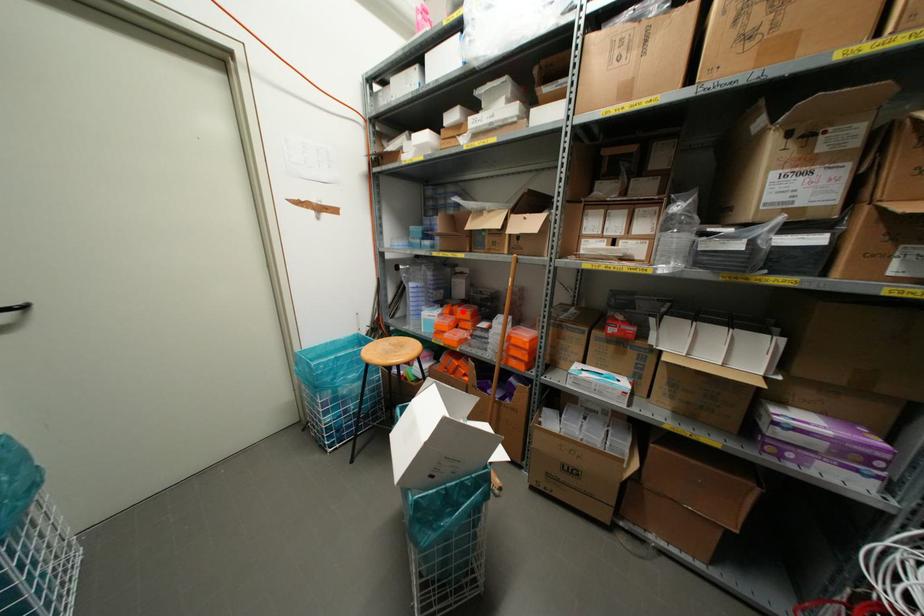
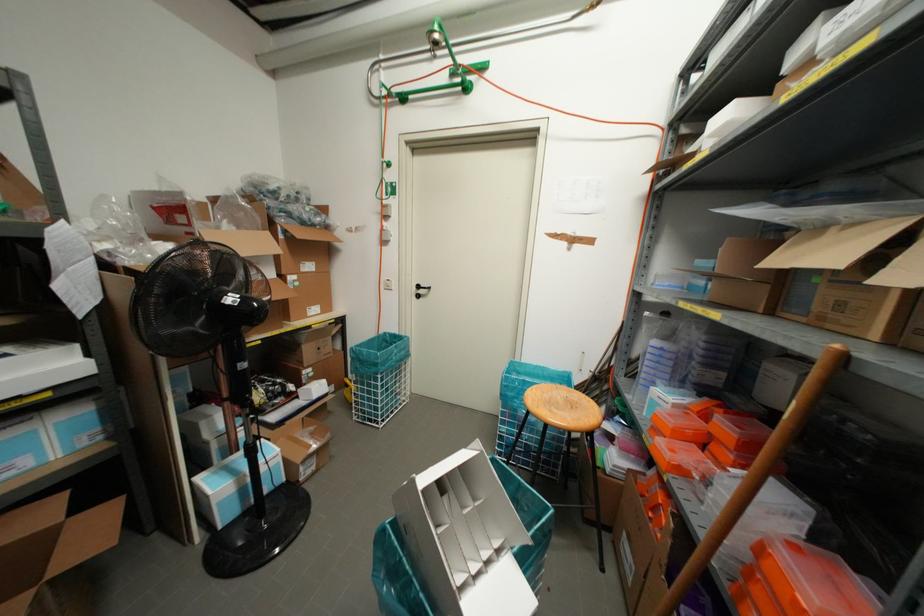
Where in the second image is the point corresponding to the highlighted location from the first image?

(723, 427)